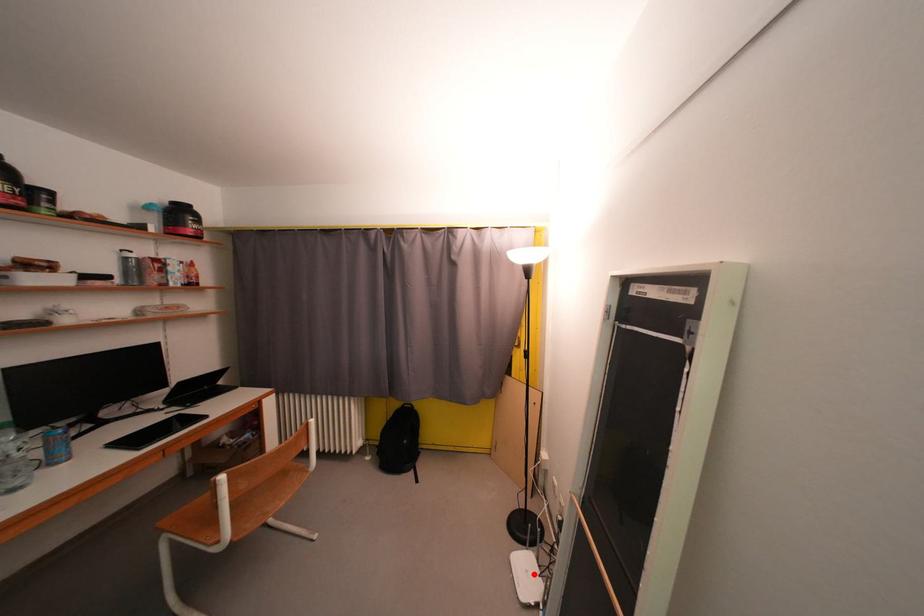
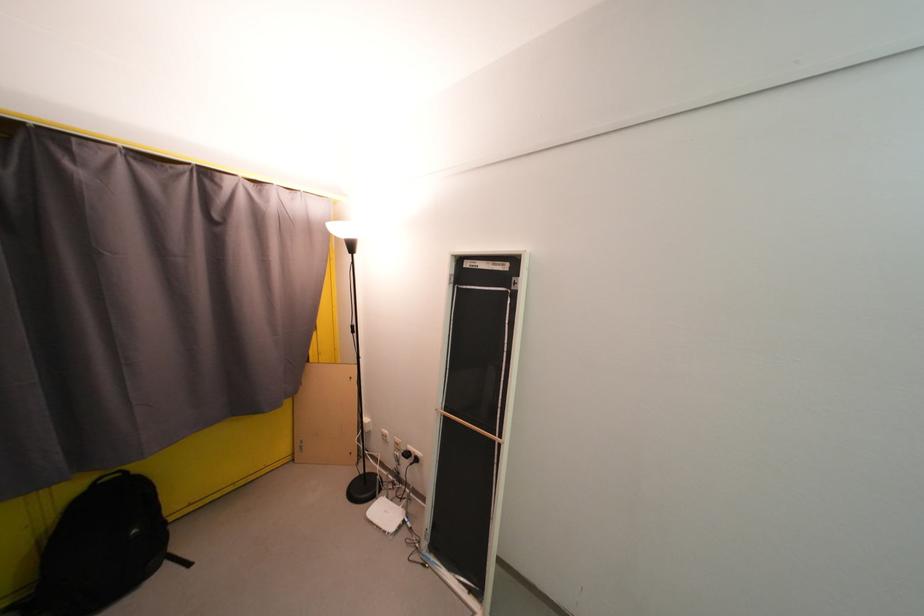
Question: I am providing you with two images of the same scene from different viewpoints. Image1 has a red point marked. In image2, the corresponding 3D location appears at what relative position? Reply with the corresponding letter.

Choices:
 (A) Closer
 (B) Farther

Answer: (B)